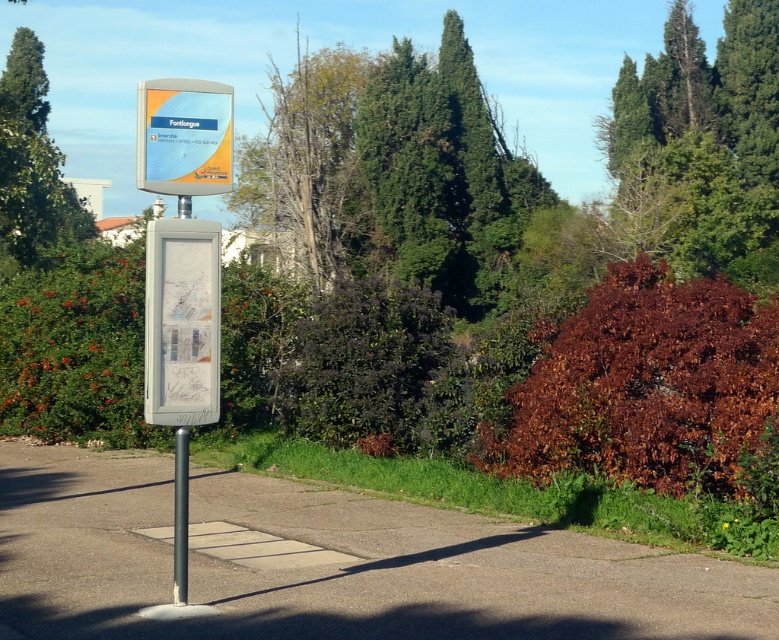
You are a hiker trying to take a photo of the matte plastic sign at center and the green leafy tree at upper right. Which object should you focus on first if you want to capture both in one frame without moving your camera?

The green leafy tree at upper right is bigger than the matte plastic sign at center, so you should focus on the matte plastic sign at center first to ensure both fit in the frame.

You are standing at the bus stop sign labeled Fontlongue. You need to locate the dead wood tree at center. According to the coordinates provided, where exactly should you look in relation to the bus stop sign?

The dead wood tree at center is located at coordinates point (309, 170) relative to the bus stop sign labeled Fontlongue.